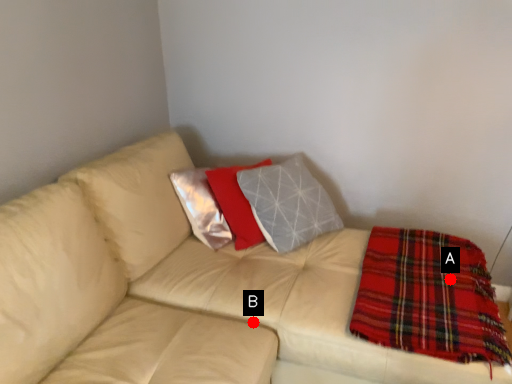
Question: Two points are circled on the image, labeled by A and B beside each circle. Which of the following is the farthest from the observer?

Choices:
 (A) A is further
 (B) B is further

Answer: (A)